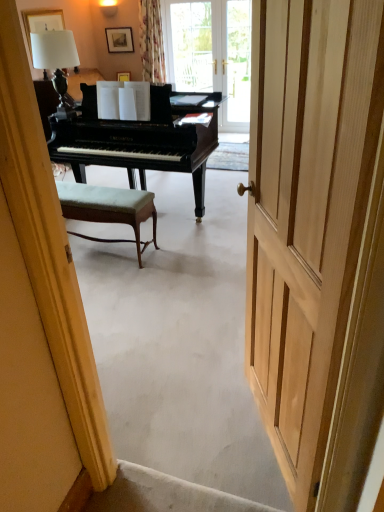
Question: From their relative heights in the image, would you say matte black picture frame at upper center, which ranks as the 2th picture frame in bottom-to-top order, is taller or shorter than matte gold picture frame at upper center, marked as the second picture frame in a top-to-bottom arrangement?

Choices:
 (A) short
 (B) tall

Answer: (B)

Question: Considering the positions of matte black picture frame at upper center, which ranks as the 2th picture frame in bottom-to-top order, and matte gold picture frame at upper center, marked as the second picture frame in a top-to-bottom arrangement, in the image, is matte black picture frame at upper center, which ranks as the 2th picture frame in bottom-to-top order, wider or thinner than matte gold picture frame at upper center, marked as the second picture frame in a top-to-bottom arrangement,?

Choices:
 (A) wide
 (B) thin

Answer: (B)

Question: Which object is the farthest from the floral fabric curtain at upper center?

Choices:
 (A) white fabric lampshade at upper left
 (B) green fabric bench at center
 (C) clear glass door at center
 (D) matte gold picture frame at upper center, which is the first picture frame from bottom to top
 (E) matte black picture frame at upper center, the first picture frame viewed from the top

Answer: (B)

Question: Which is farther from the matte gold picture frame at upper center, marked as the second picture frame in a top-to-bottom arrangement?

Choices:
 (A) matte black picture frame at upper center, which ranks as the 2th picture frame in bottom-to-top order
 (B) green fabric bench at center
 (C) white fabric lampshade at upper left
 (D) floral fabric curtain at upper center
 (E) light wood door at center

Answer: (E)